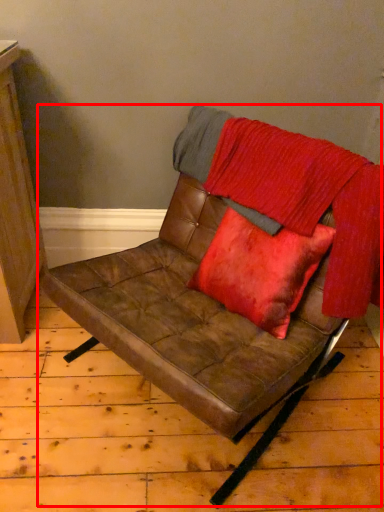
Question: Observing the image, what is the correct spatial positioning of chair (annotated by the red box) in reference to blanket?

Choices:
 (A) left
 (B) right

Answer: (A)